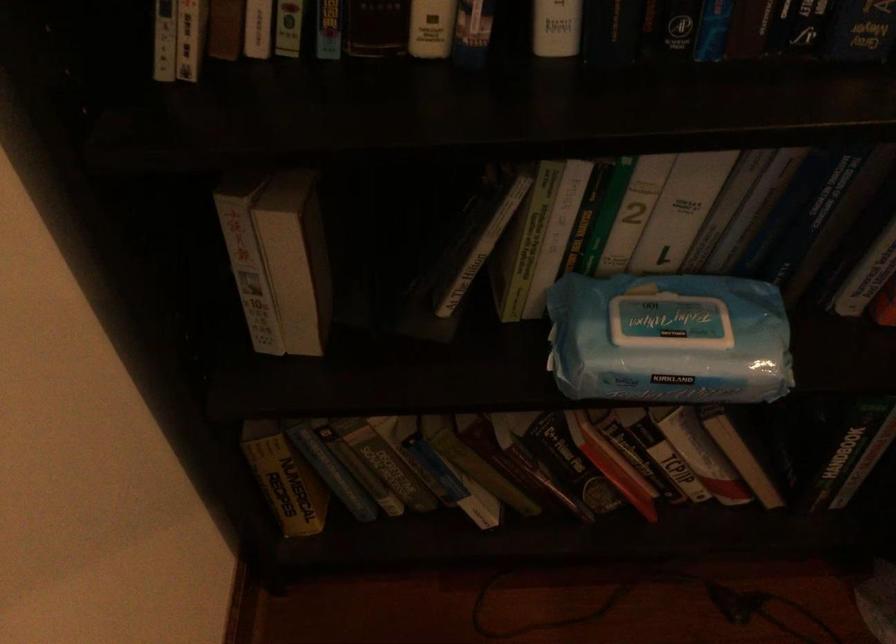
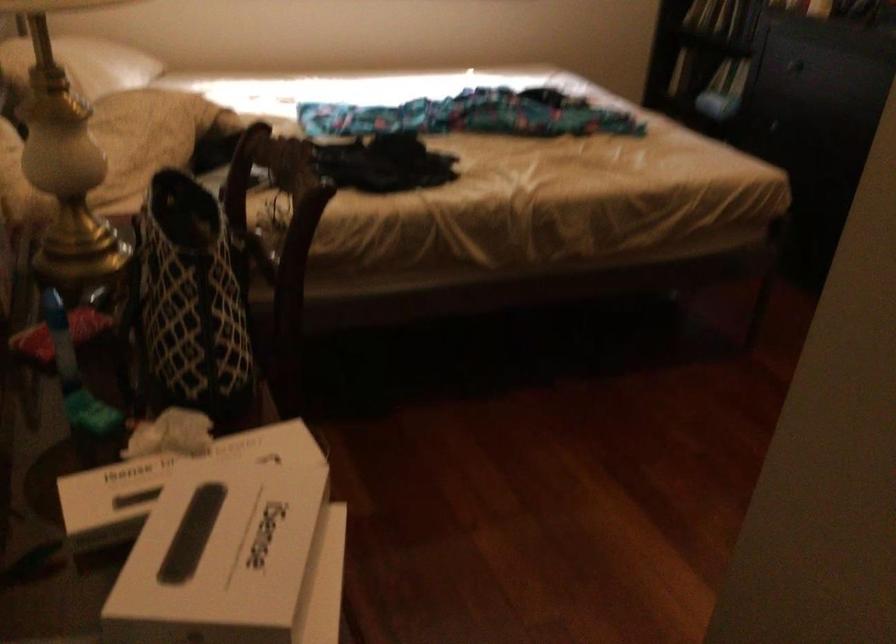
Question: I am providing you with two images of the same scene from different viewpoints. Please identify which objects are invisible in image2.

Choices:
 (A) patterned tote bag
 (B) white pillow
 (C) green hanging bag
 (D) red spine book

Answer: (D)